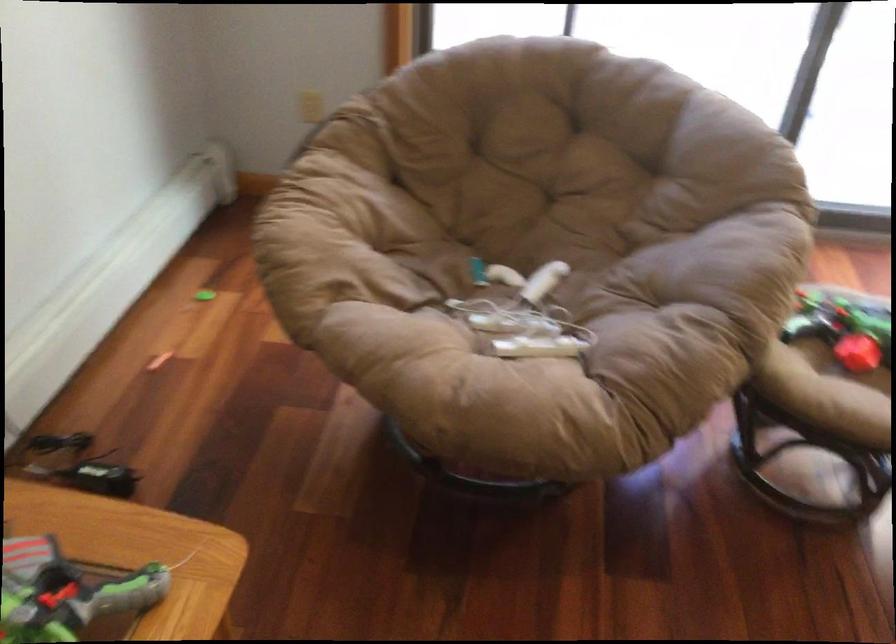
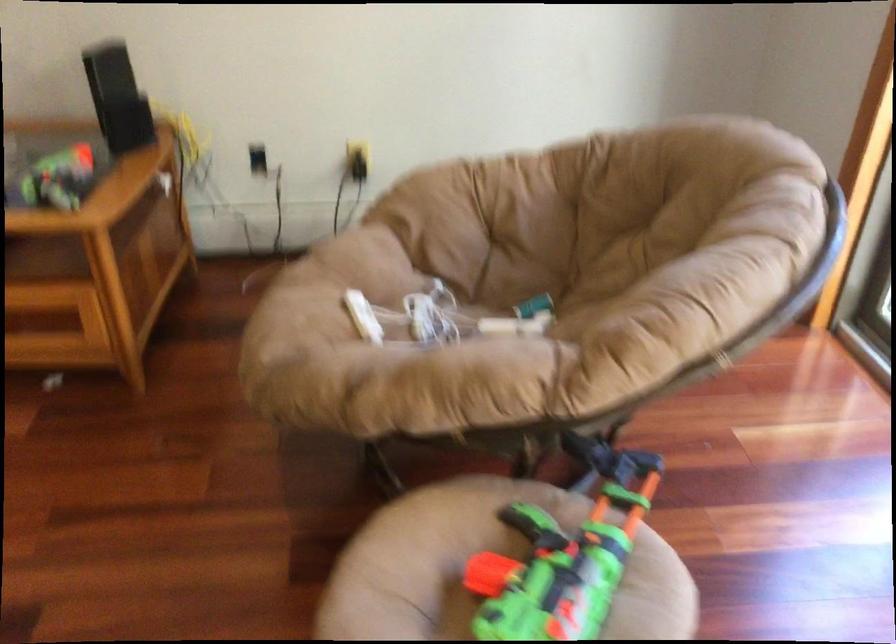
Where in the second image is the point corresponding to (x=545, y=345) from the first image?

(363, 317)